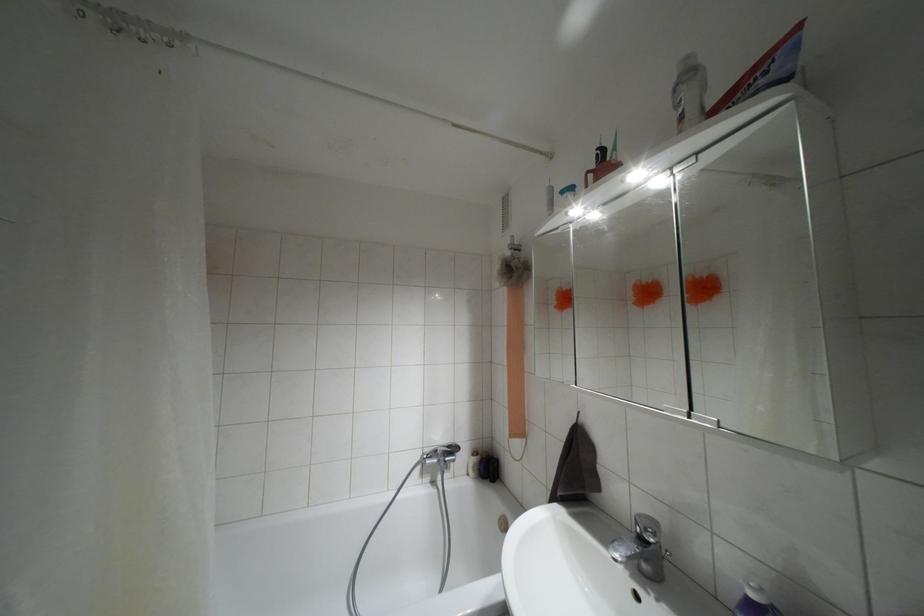
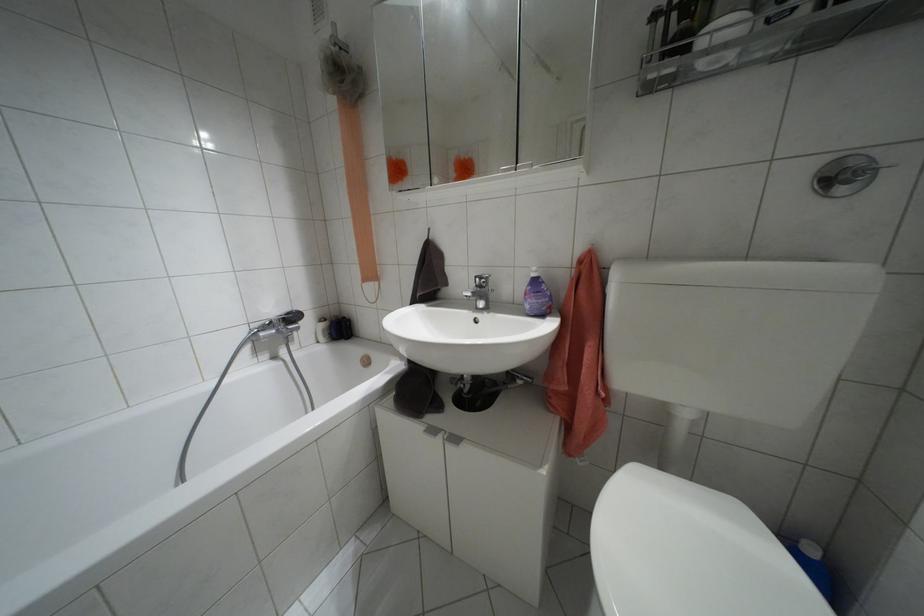
Find the pixel in the second image that matches [641,538] in the first image.

(479, 286)